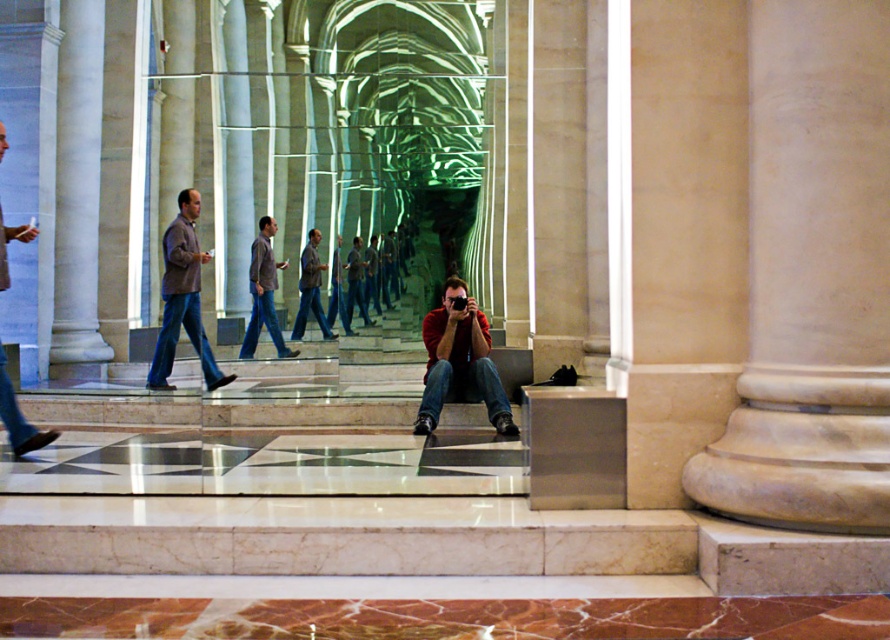
Can you confirm if brown woolen jacket at left is thinner than matte brown jacket at left?

Incorrect, brown woolen jacket at left's width is not less than matte brown jacket at left's.

Image resolution: width=890 pixels, height=640 pixels. Identify the location of brown woolen jacket at left. (182, 298).

Is matte red shirt at center shorter than matte brown jacket at center?

Yes.

Who is positioned more to the right, matte red shirt at center or matte brown jacket at center?

Positioned to the right is matte red shirt at center.

This screenshot has height=640, width=890. What do you see at coordinates (459, 362) in the screenshot? I see `matte red shirt at center` at bounding box center [459, 362].

The width and height of the screenshot is (890, 640). I want to click on matte red shirt at center, so [x=459, y=362].

Does brown woolen jacket at left appear on the right side of dark brown leather jacket at center?

Incorrect, brown woolen jacket at left is not on the right side of dark brown leather jacket at center.

The width and height of the screenshot is (890, 640). What do you see at coordinates (182, 298) in the screenshot?
I see `brown woolen jacket at left` at bounding box center [182, 298].

Where is `brown woolen jacket at left`? brown woolen jacket at left is located at coordinates point(182,298).